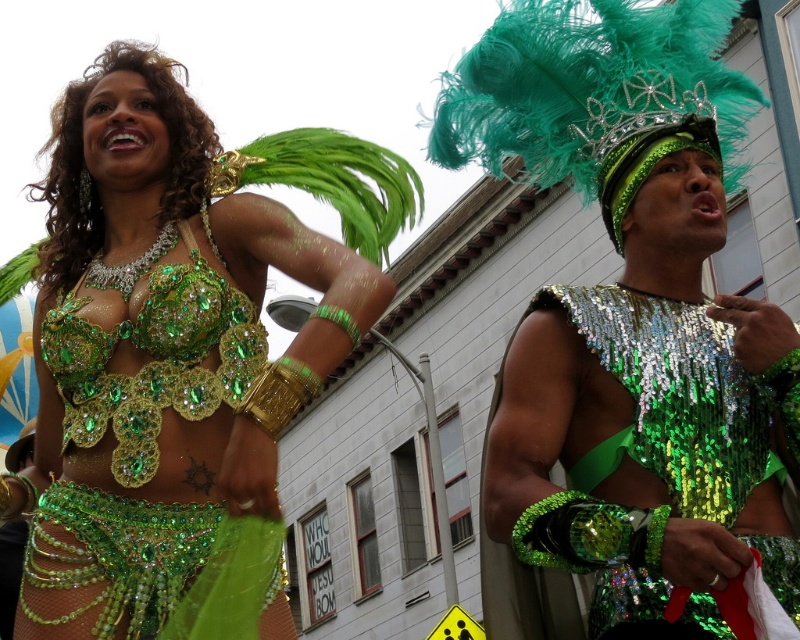
Which is more to the right, shiny sequin vest at center or green sequined top at center?

From the viewer's perspective, green sequined top at center appears more on the right side.

Between shiny sequin vest at center and green sequined top at center, which one appears on the left side from the viewer's perspective?

shiny sequin vest at center

Where is `shiny sequin vest at center`? The height and width of the screenshot is (640, 800). shiny sequin vest at center is located at coordinates (620, 323).

Where is `shiny sequin vest at center`? This screenshot has height=640, width=800. shiny sequin vest at center is located at coordinates (620, 323).

Does point (533, 458) come behind point (72, 268)?

That is False.

Is point (796, 380) farther from camera compared to point (152, 272)?

Yes, point (796, 380) is farther from viewer.

Find the location of a particular element. The width and height of the screenshot is (800, 640). shiny sequin vest at center is located at coordinates (620, 323).

Is green sequined bikini top at upper left bigger than green sequined top at center?

Indeed, green sequined bikini top at upper left has a larger size compared to green sequined top at center.

Is green sequined bikini top at upper left below green sequined top at center?

No.

The width and height of the screenshot is (800, 640). In order to click on green sequined bikini top at upper left in this screenshot , I will do [x=158, y=352].